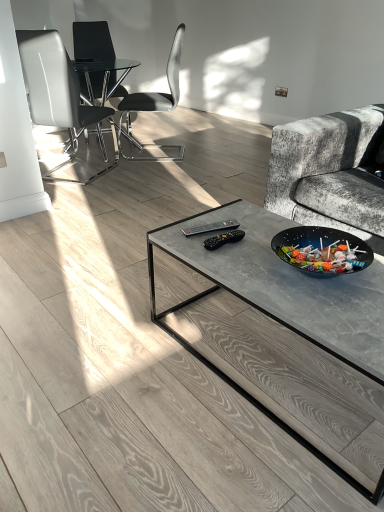
Question: From a real-world perspective, is white leather chair at left, which is the 3th chair in back-to-front order, positioned above or below black glass chair at upper left, which is counted as the third chair, starting from the front?

Choices:
 (A) above
 (B) below

Answer: (A)

Question: Looking at their shapes, would you say white leather chair at left, which is the 3th chair in back-to-front order, is wider or thinner than black glass chair at upper left, arranged as the first chair when viewed from the back?

Choices:
 (A) wide
 (B) thin

Answer: (A)

Question: Considering the real-world distances, which object is closest to the black glass chair at upper left, which is counted as the third chair, starting from the front?

Choices:
 (A) black plastic chair at center, which appears as the second chair when viewed from the back
 (B) white leather chair at left, which is the 3th chair in back-to-front order

Answer: (B)

Question: Estimate the real-world distances between objects in this image. Which object is farther from the black plastic chair at center, which is the second chair from front to back?

Choices:
 (A) white leather chair at left, acting as the first chair starting from the front
 (B) black glass chair at upper left, which is counted as the third chair, starting from the front

Answer: (A)